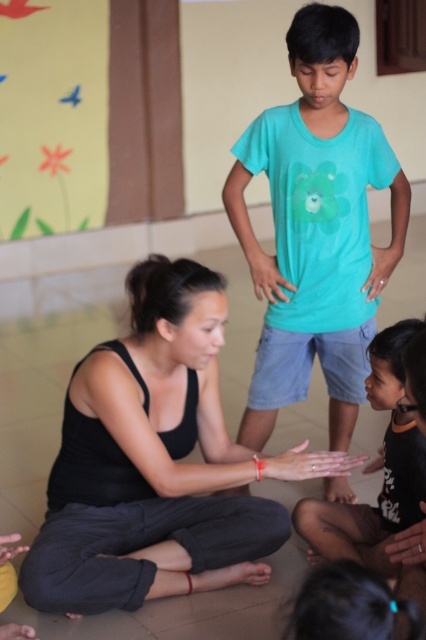
Question: Considering the real-world distances, which object is farthest from the dark brown skin at lower right?

Choices:
 (A) turquoise cotton shirt at center
 (B) black matte tank top at center

Answer: (A)

Question: Can you confirm if black matte tank top at center is bigger than turquoise cotton shirt at center?

Choices:
 (A) yes
 (B) no

Answer: (B)

Question: Which point is farther from the camera taking this photo?

Choices:
 (A) (298, 316)
 (B) (347, 525)
 (C) (91, 531)

Answer: (A)

Question: Does black matte tank top at center have a smaller size compared to dark brown skin at lower right?

Choices:
 (A) yes
 (B) no

Answer: (B)

Question: Is black matte tank top at center positioned before turquoise cotton shirt at center?

Choices:
 (A) no
 (B) yes

Answer: (B)

Question: Among these points, which one is nearest to the camera?

Choices:
 (A) (399, 518)
 (B) (138, 264)
 (C) (368, 320)

Answer: (A)